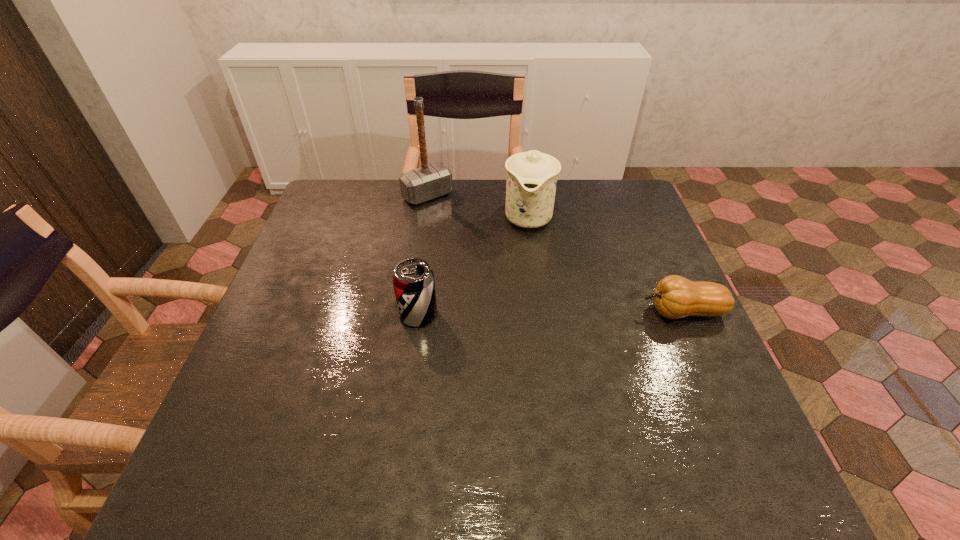
Find the location of a particular element. The image size is (960, 540). unoccupied area between the second object from right to left and the third tallest object is located at coordinates (473, 266).

Where is `free space between the shortest object and the third shortest object`? free space between the shortest object and the third shortest object is located at coordinates (605, 265).

This screenshot has height=540, width=960. In order to click on vacant area that lies between the chinaware and the third tallest object in this screenshot , I will do `click(473, 266)`.

Select which object appears as the second closest to the tallest object. Please provide its 2D coordinates. Your answer should be formatted as a tuple, i.e. [(x, y)], where the tuple contains the x and y coordinates of a point satisfying the conditions above.

[(413, 280)]

Locate an element on the screen. Image resolution: width=960 pixels, height=540 pixels. object that can be found as the closest to the hammer is located at coordinates (532, 176).

You are a GUI agent. You are given a task and a screenshot of the screen. Output one action in this format:
    pyautogui.click(x=<x>, y=<y>)
    Task: Click on the blank area in the image that satisfies the following two spatial constraints: 1. on the back side of the third tallest object; 2. on the stem side of the gourd
    
    Given the screenshot: What is the action you would take?
    pyautogui.click(x=419, y=312)

In order to click on blank area in the image that satisfies the following two spatial constraints: 1. on the back side of the second shortest object; 2. on the stem side of the shortest object in this screenshot , I will do `click(419, 312)`.